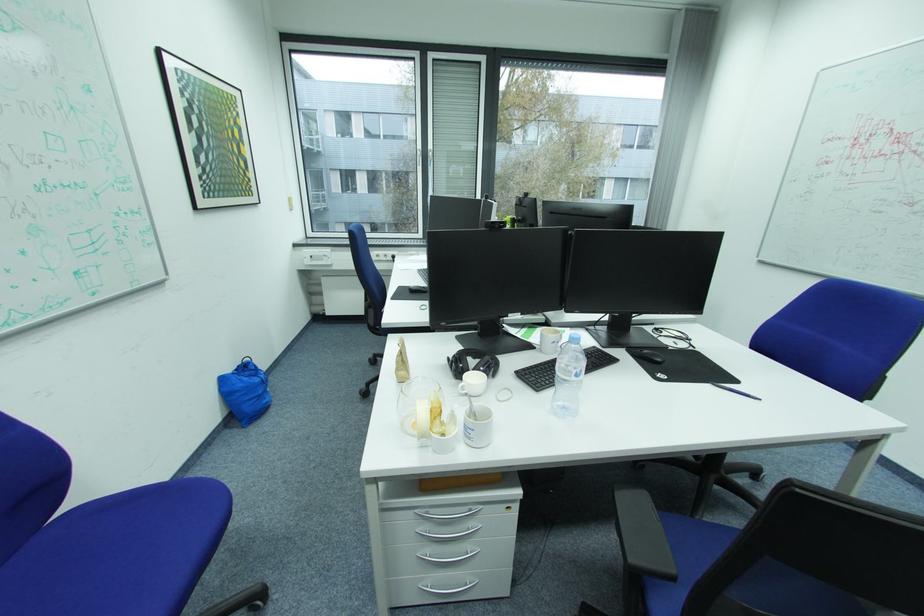
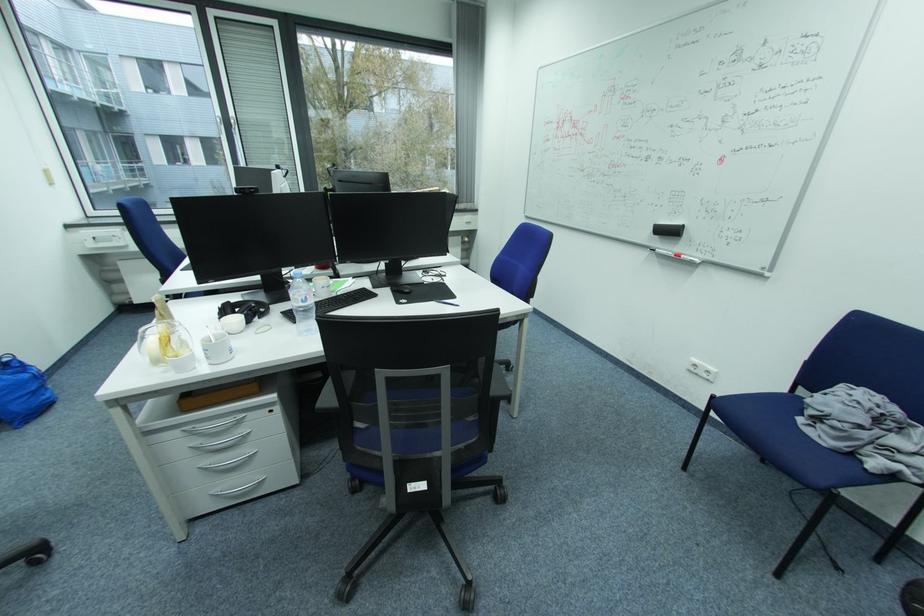
Where in the second image is the point corresponding to point 249,386 from the first image?

(9, 385)